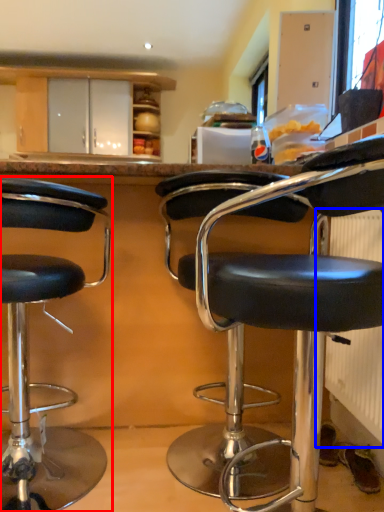
Question: Which point is further to the camera, chair (highlighted by a red box) or radiator (highlighted by a blue box)?

Choices:
 (A) chair
 (B) radiator

Answer: (B)